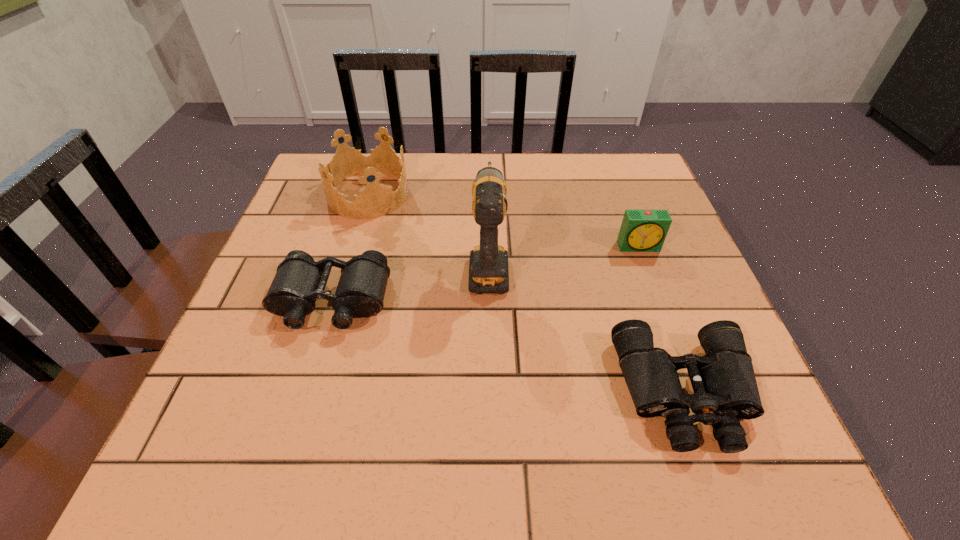
You are a GUI agent. You are given a task and a screenshot of the screen. Output one action in this format:
    pyautogui.click(x=<x>, y=<y>)
    Task: Click on the third object from right to left
    
    Given the screenshot: What is the action you would take?
    pyautogui.click(x=488, y=268)

Identify the location of drill. coord(488,268).

This screenshot has width=960, height=540. Find the location of `tiara`. tiara is located at coordinates point(375,200).

What are the coordinates of `the second tallest object` in the screenshot? It's located at (375, 200).

Image resolution: width=960 pixels, height=540 pixels. I want to click on alarm clock, so click(x=641, y=230).

Find the location of a particular element. This screenshot has width=960, height=540. the left binoculars is located at coordinates pyautogui.click(x=299, y=281).

Find the location of `the nearer binoculars`. the nearer binoculars is located at coordinates (725, 389).

Find the location of a particular element. the right binoculars is located at coordinates (725, 389).

This screenshot has height=540, width=960. I want to click on free space located 0.310m with the drill bit of the tallest object facing forward, so click(x=487, y=165).

Locate an element on the screen. This screenshot has height=540, width=960. free spot located with the drill bit of the tallest object facing forward is located at coordinates (487, 167).